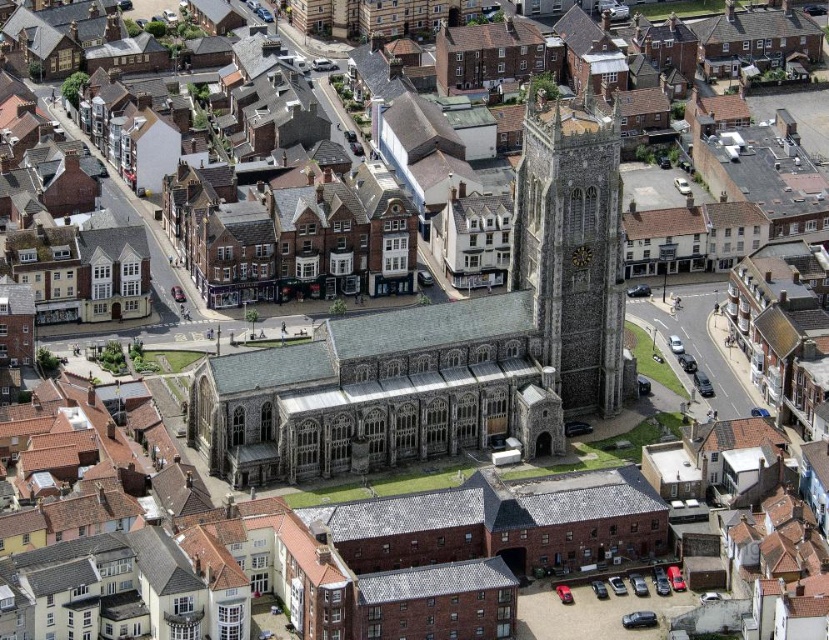
You are a tourist standing at the edge of the historic town center. You see the stone church at center and the stone clock tower at center. According to the aerial view, which one is positioned higher up in the image?

The stone clock tower at center is positioned higher up in the image than the stone church at center because the stone church at center is below the stone clock tower at center.

You are a tourist standing at the edge of the historic town center. You see the stone church at center and the stone clock tower at center. Which structure has a greater height?

The stone church at center is much taller than the stone clock tower at center, so the stone church at center has a greater height.